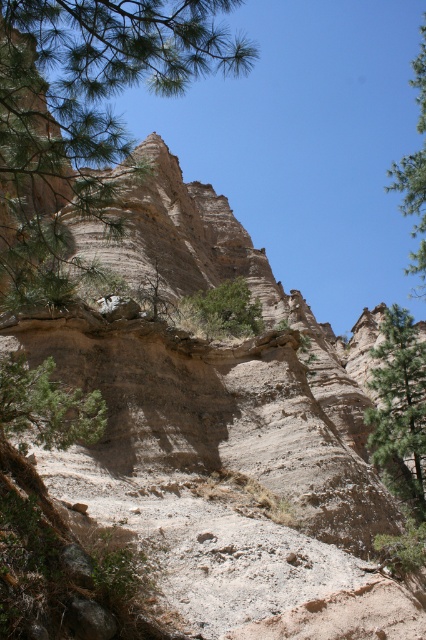
You are a hiker planning to take a photo of the green leafy shrub at center. There is a green leafy tree at upper right in the scene. Will the tree block your view of the shrub?

The green leafy tree at upper right is positioned over the green leafy shrub at center, so it will block your view of the shrub.